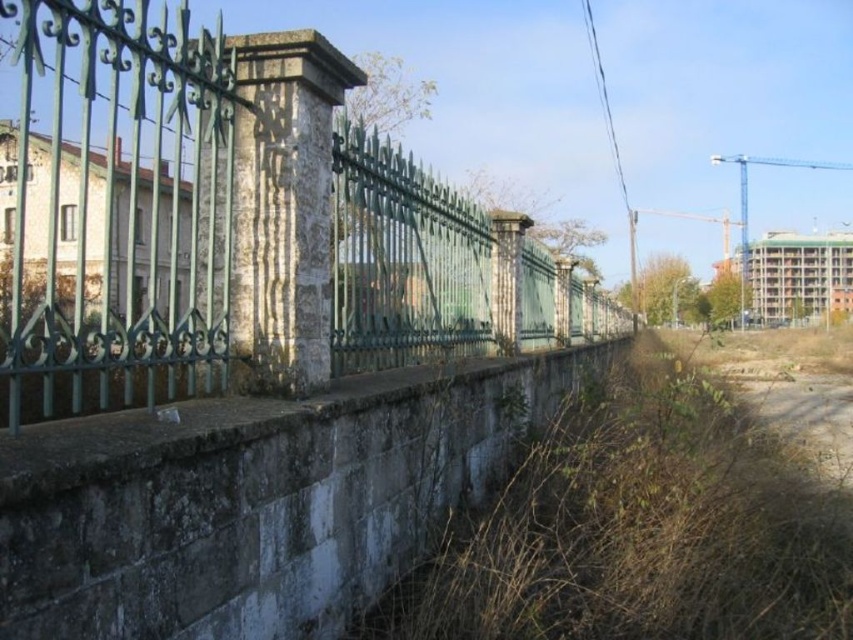
You are standing at the point marked by the coordinate point at point (233, 224). Which object is directly to your left?

The point marked by the coordinate point at point (233, 224) is part of the green wrought iron fence at left, so the object directly to your left would be the green wrought iron fence at left itself.

You are a painter standing at the corner of the green wrought iron fence at left and want to paint the brown dry grass at lower right. Since you can only reach up to the height of the fence, will you be able to paint the grass without needing a ladder?

The green wrought iron fence at left is taller than the brown dry grass at lower right. Since the grass is shorter than the fence, you can reach it without needing a ladder.

You are standing in front of an old fence and a stone wall. You notice two points marked on the image. The first point is at coordinate point[280,195] and the second is at point[547,481]. From your current position, which point is closer to you?

Point[280,195] is in front of point[547,481], so the first point is closer to you.